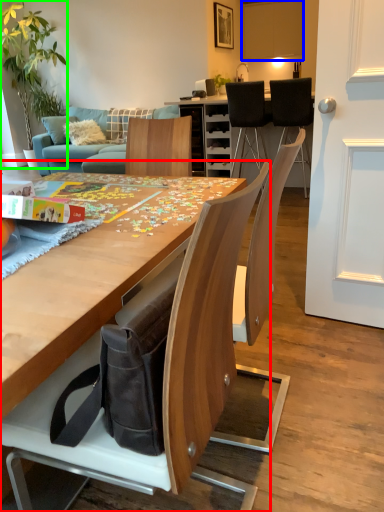
Question: Which object is positioned closest to chair (highlighted by a red box)? Select from cabinetry (highlighted by a blue box) and houseplant (highlighted by a green box).

Choices:
 (A) cabinetry
 (B) houseplant

Answer: (B)